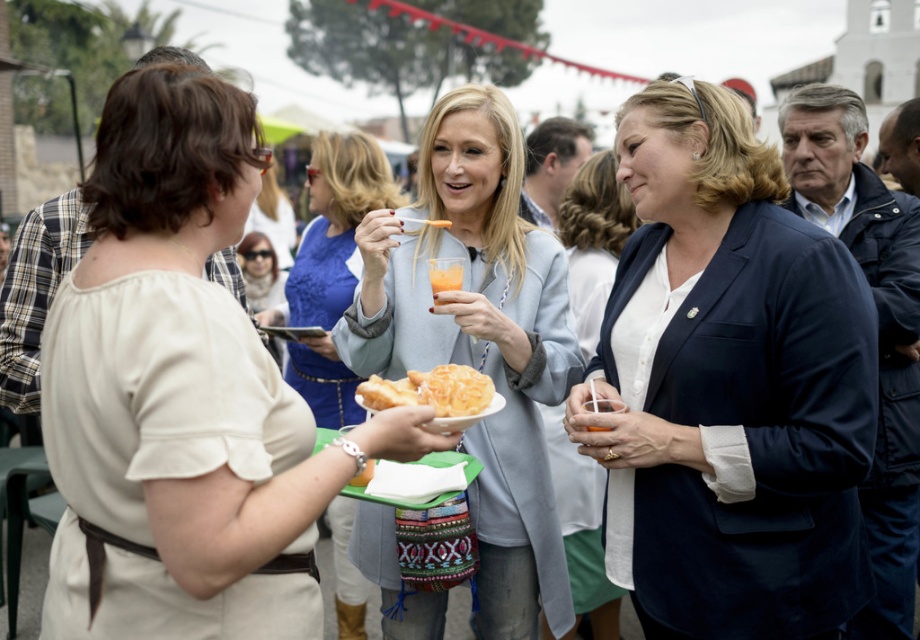
You are at the gathering and want to talk to both the matte beige blouse at center and the blue lace dress at center. Which one should you approach first to be closer?

You should approach the matte beige blouse at center first because it is closer to you than the blue lace dress at center.

You are at a social gathering and see a blue lace dress at center and a translucent plastic cup at center. Which one is more to the left?

The blue lace dress at center is more to the left than the translucent plastic cup at center.